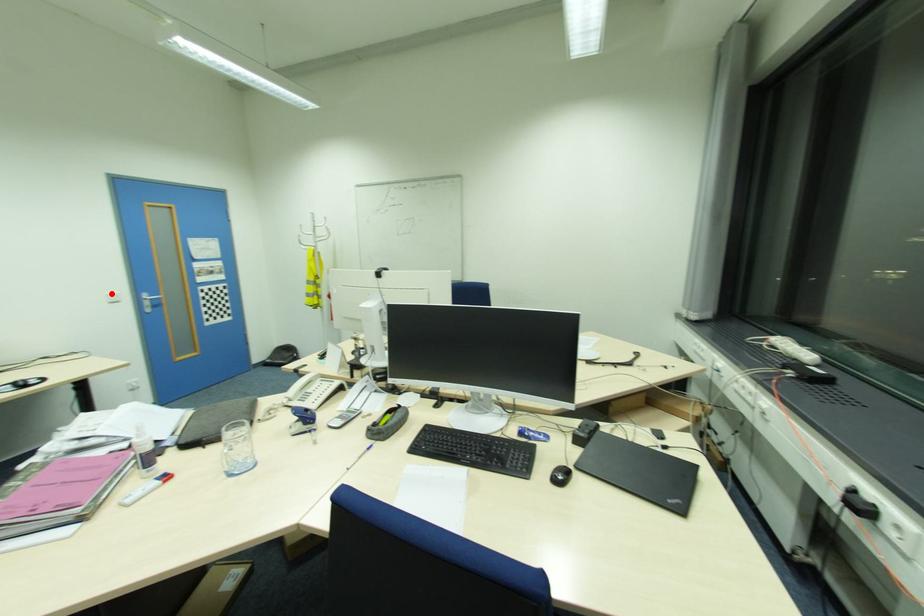
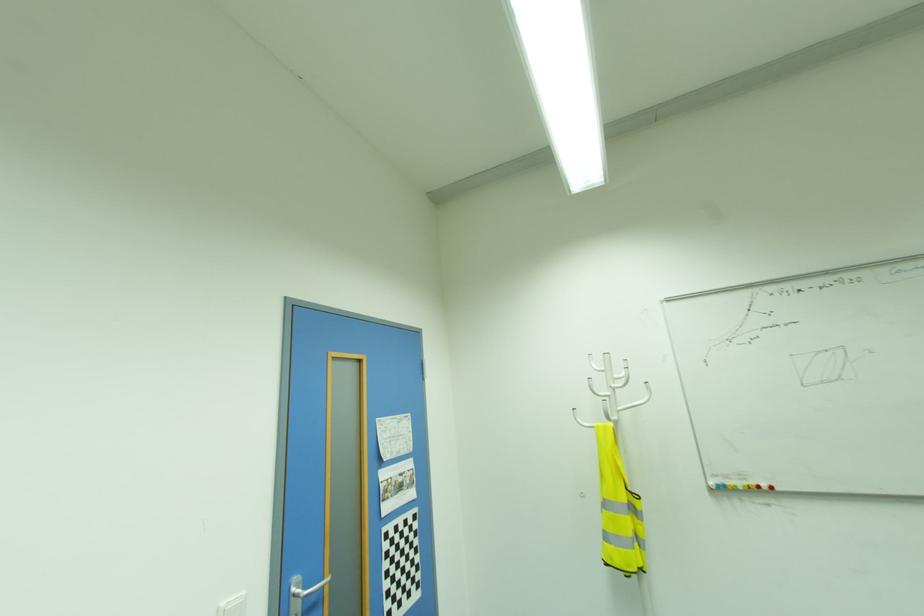
In the second image, find the point that corresponds to the highlighted location in the first image.

(226, 602)